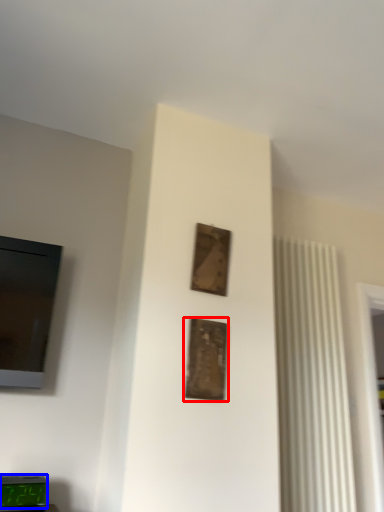
Question: Among these objects, which one is farthest to the camera, picture frame (highlighted by a red box) or alarm clock (highlighted by a blue box)?

Choices:
 (A) picture frame
 (B) alarm clock

Answer: (A)